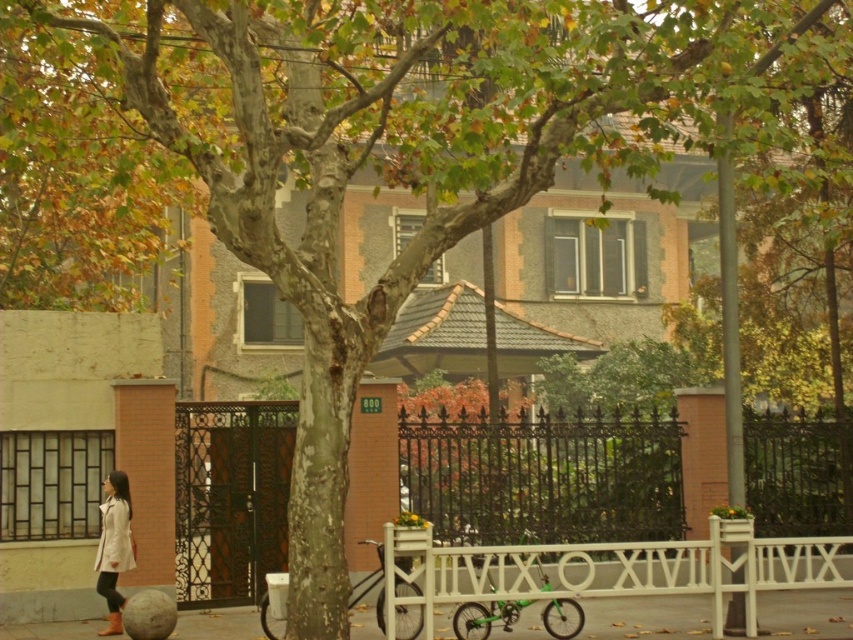
Does white painted metal fence at center have a greater width compared to light beige coat at lower left?

Yes.

Identify the location of white painted metal fence at center. Image resolution: width=853 pixels, height=640 pixels. (544, 477).

Which is behind, point (695, 596) or point (113, 472)?

Point (695, 596)

Does smooth concrete pavement at lower center appear on the right side of light beige coat at lower left?

Yes, smooth concrete pavement at lower center is to the right of light beige coat at lower left.

Between point (817, 596) and point (115, 624), which one is positioned behind?

Positioned behind is point (817, 596).

Locate an element on the screen. smooth concrete pavement at lower center is located at coordinates (646, 618).

Is white painted metal fence at center below smooth concrete pavement at lower center?

No.

Does point (241, 442) come in front of point (639, 630)?

No, (241, 442) is further to viewer.

You are a GUI agent. You are given a task and a screenshot of the screen. Output one action in this format:
    pyautogui.click(x=<x>, y=<y>)
    Task: Click on the white painted metal fence at center
    
    Given the screenshot: What is the action you would take?
    pyautogui.click(x=544, y=477)